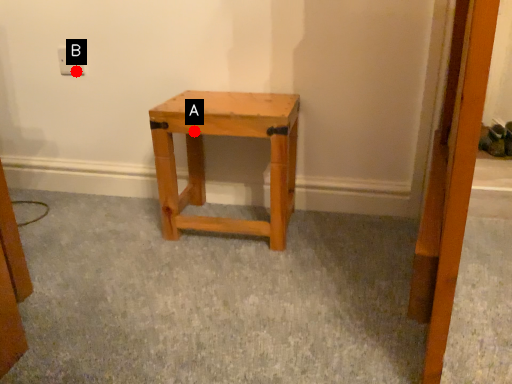
Question: Two points are circled on the image, labeled by A and B beside each circle. Which point is closer to the camera?

Choices:
 (A) A is closer
 (B) B is closer

Answer: (A)